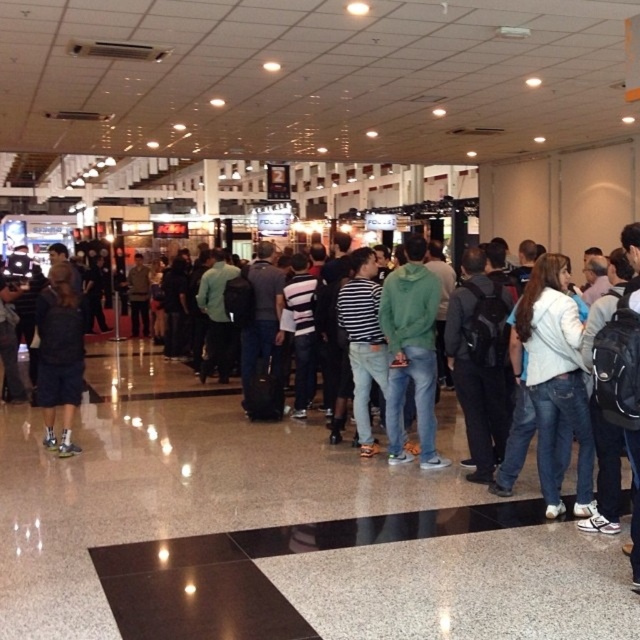
Question: Is white cotton jacket at right wider than dark gray shorts at left?

Choices:
 (A) yes
 (B) no

Answer: (A)

Question: Which of the following is the closest to the observer?

Choices:
 (A) (72, 280)
 (B) (557, 364)

Answer: (B)

Question: Can you confirm if white cotton jacket at right is positioned above dark gray shorts at left?

Choices:
 (A) yes
 (B) no

Answer: (B)

Question: Among these objects, which one is nearest to the camera?

Choices:
 (A) dark gray shorts at left
 (B) white cotton jacket at right

Answer: (B)

Question: Is white cotton jacket at right positioned behind dark gray shorts at left?

Choices:
 (A) no
 (B) yes

Answer: (A)

Question: Which of the following is the farthest from the observer?

Choices:
 (A) dark gray shorts at left
 (B) white cotton jacket at right

Answer: (A)